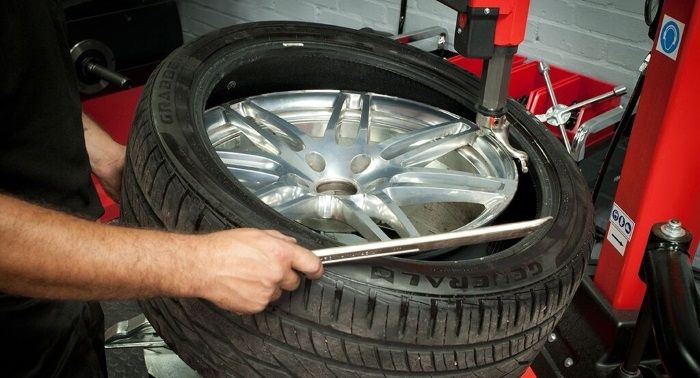
The image size is (700, 378). I want to click on white brick wall, so click(606, 45).